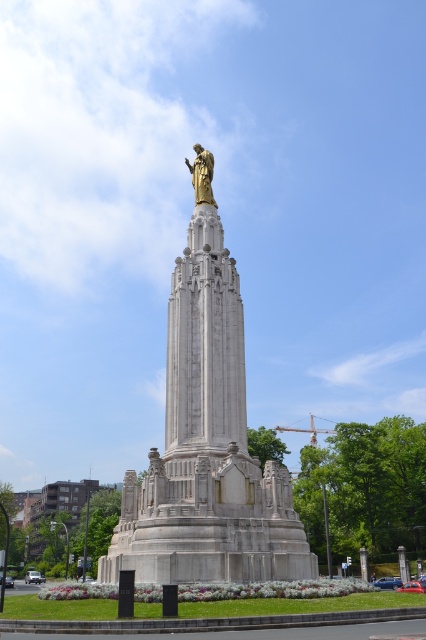
Question: Which object appears farthest from the camera in this image?

Choices:
 (A) polished bronze statue at center
 (B) gold polished statue at upper center

Answer: (B)

Question: Is polished bronze statue at center positioned in front of gold polished statue at upper center?

Choices:
 (A) no
 (B) yes

Answer: (B)

Question: Which point is farther to the camera?

Choices:
 (A) polished bronze statue at center
 (B) gold polished statue at upper center

Answer: (B)

Question: Which point is closer to the camera taking this photo?

Choices:
 (A) (193, 163)
 (B) (193, 493)

Answer: (B)

Question: Does polished bronze statue at center appear over gold polished statue at upper center?

Choices:
 (A) yes
 (B) no

Answer: (B)

Question: Can you confirm if polished bronze statue at center is bigger than gold polished statue at upper center?

Choices:
 (A) no
 (B) yes

Answer: (B)